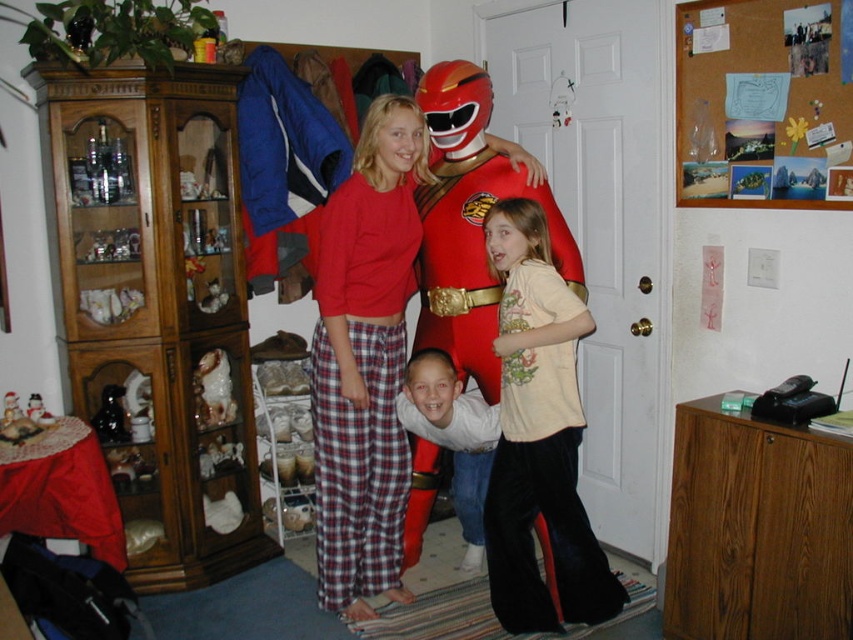
Question: Which object is the closest to the light beige cotton shirt at center?

Choices:
 (A) red matte costume at center
 (B) smooth white shirt at center

Answer: (B)

Question: Which point is closer to the camera?

Choices:
 (A) (485, 490)
 (B) (537, 476)
 (C) (444, 300)

Answer: (B)

Question: Is light beige cotton shirt at center smaller than red shiny plastic costume at center?

Choices:
 (A) yes
 (B) no

Answer: (A)

Question: Where is light beige cotton shirt at center located in relation to red matte costume at center in the image?

Choices:
 (A) below
 (B) above

Answer: (A)

Question: Considering the real-world distances, which object is closest to the red shiny plastic costume at center?

Choices:
 (A) shiny red costume at center
 (B) red matte costume at center

Answer: (A)

Question: Does light beige cotton shirt at center appear on the right side of red shiny plastic costume at center?

Choices:
 (A) no
 (B) yes

Answer: (B)